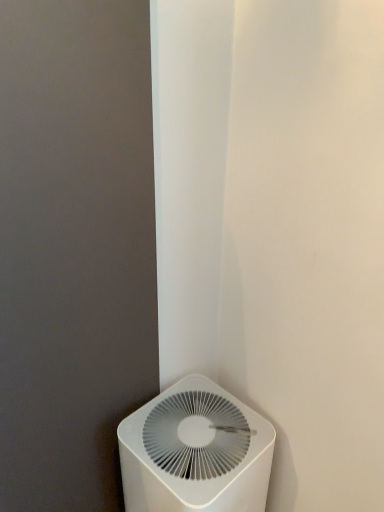
The height and width of the screenshot is (512, 384). In order to click on white plastic air purifier at lower left in this screenshot , I will do `click(195, 452)`.

The height and width of the screenshot is (512, 384). What do you see at coordinates (195, 452) in the screenshot?
I see `white plastic air purifier at lower left` at bounding box center [195, 452].

Where is `white plastic air purifier at lower left`? white plastic air purifier at lower left is located at coordinates (195, 452).